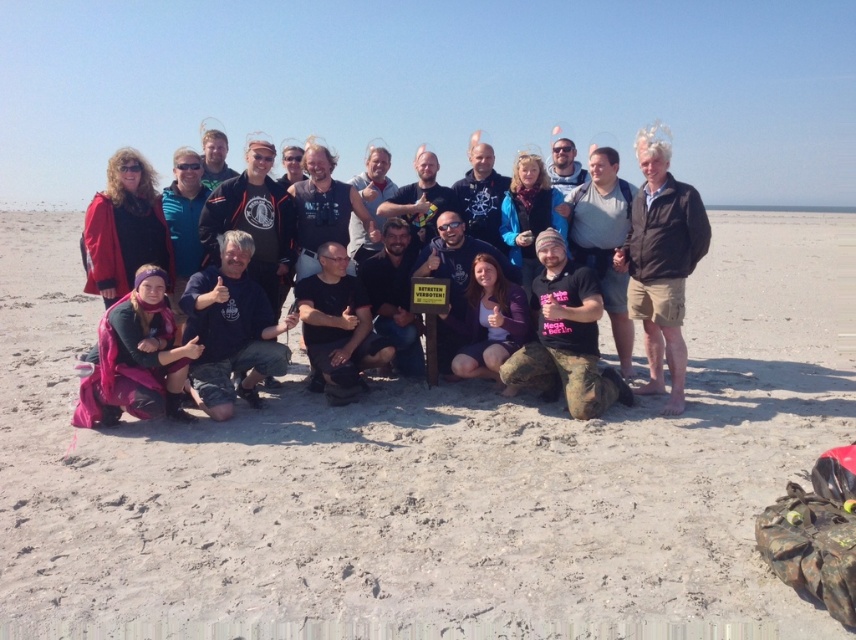
In the scene shown: You are a photographer trying to capture a closeup of the smooth sand at center and the pink fabric at center. Which object should you zoom in on to ensure both are visible in the frame without moving the camera?

The smooth sand at center has a smaller size compared to pink fabric at center, so you should zoom in on the pink fabric at center to ensure both are visible in the frame without moving the camera.

Please provide the 2D coordinates of the smooth sand at center in the image. The coordinates should be in the format of a tuple with two decimal numbers separated by a comma. Your answer should only contain the coordinates without any additional text or explanation.

The 2D coordinates of the smooth sand at center are at point (429, 467).